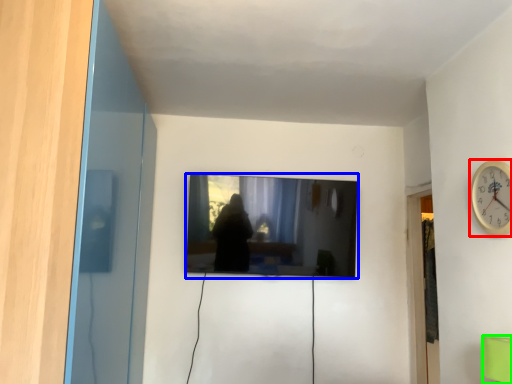
Question: Which is nearer to the wall clock (highlighted by a red box)? television (highlighted by a blue box) or furniture (highlighted by a green box).

Choices:
 (A) television
 (B) furniture

Answer: (B)